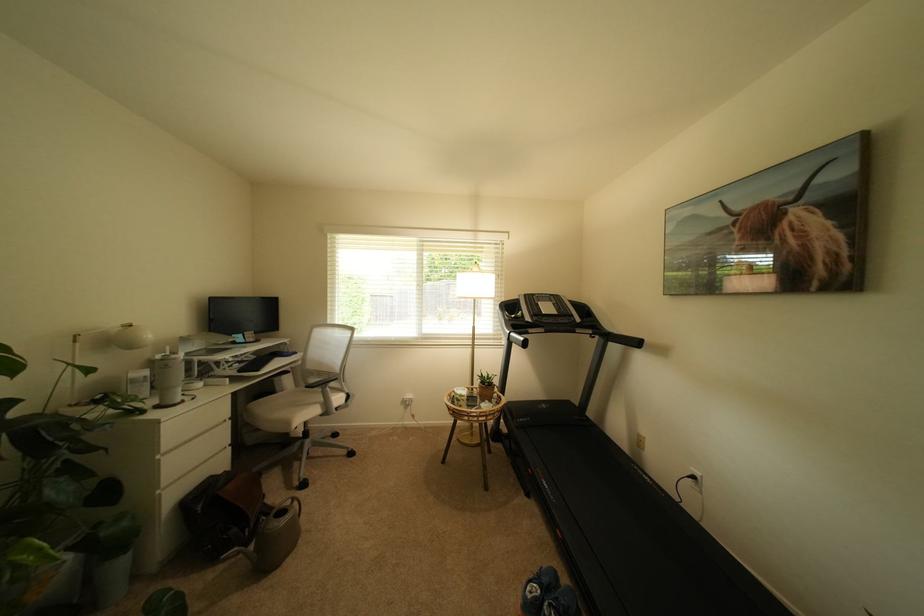
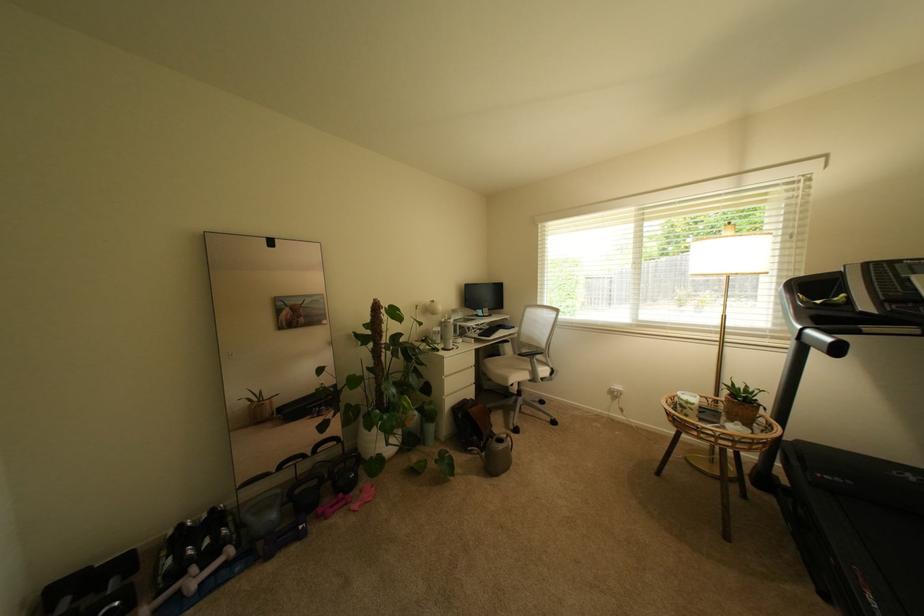
The point at (305,440) is marked in the first image. Where is the corresponding point in the second image?

(521, 395)